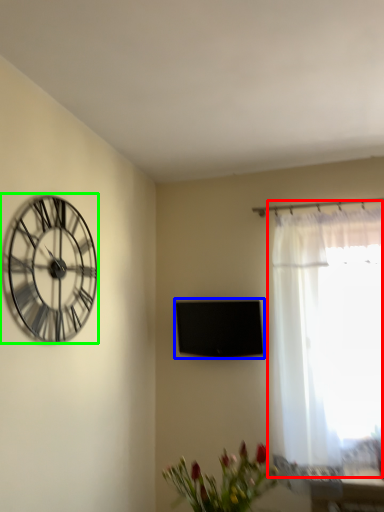
Question: Based on their relative distances, which object is farther from window (highlighted by a red box)? Choose from window screen (highlighted by a blue box) and wall clock (highlighted by a green box).

Choices:
 (A) window screen
 (B) wall clock

Answer: (B)